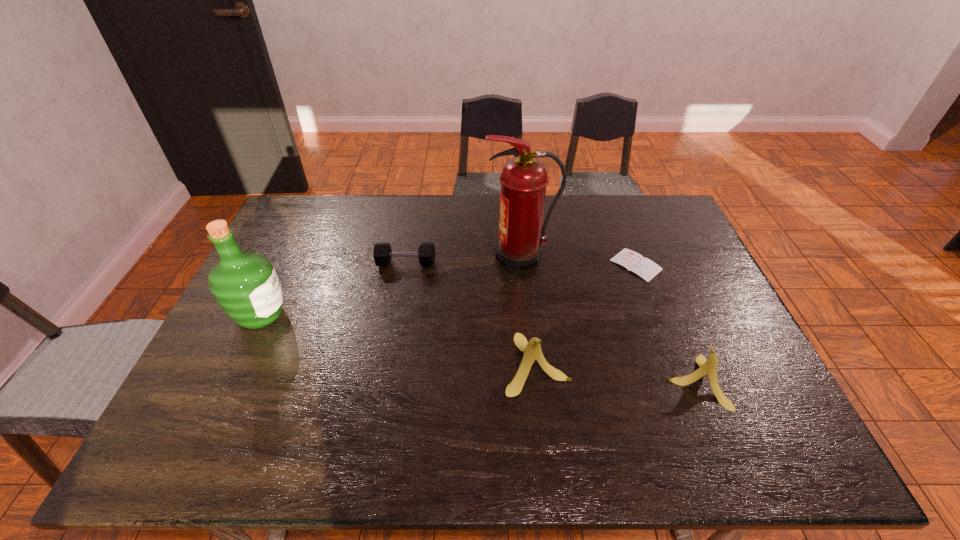
Where is `vacant space situated 0.180m on the left of the taller banana`? The image size is (960, 540). vacant space situated 0.180m on the left of the taller banana is located at coordinates (434, 363).

The height and width of the screenshot is (540, 960). Find the location of `free space located on the left of the shorter banana`. free space located on the left of the shorter banana is located at coordinates (515, 382).

The height and width of the screenshot is (540, 960). In order to click on free spot located on the front-facing side of the fire extinguisher in this screenshot , I will do `click(397, 258)`.

The width and height of the screenshot is (960, 540). I want to click on vacant space located 0.090m on the front-facing side of the fire extinguisher, so click(x=457, y=258).

What are the coordinates of `vacant region located on the front-facing side of the fire extinguisher` in the screenshot? It's located at (432, 258).

Locate an element on the screen. free region located on the front of the shortest object is located at coordinates (649, 299).

What are the coordinates of `free location located on the left of the fifth object from right to left` in the screenshot? It's located at (304, 264).

Where is `vacant region located on the front-facing side of the second tallest object`? vacant region located on the front-facing side of the second tallest object is located at coordinates (418, 315).

Identify the location of object that is positioned at the left edge. This screenshot has width=960, height=540. (245, 284).

At what (x,y) coordinates should I click in order to perform the action: click on banana at the right edge. Please return your answer as a coordinate pair (x, y). Looking at the image, I should click on (708, 367).